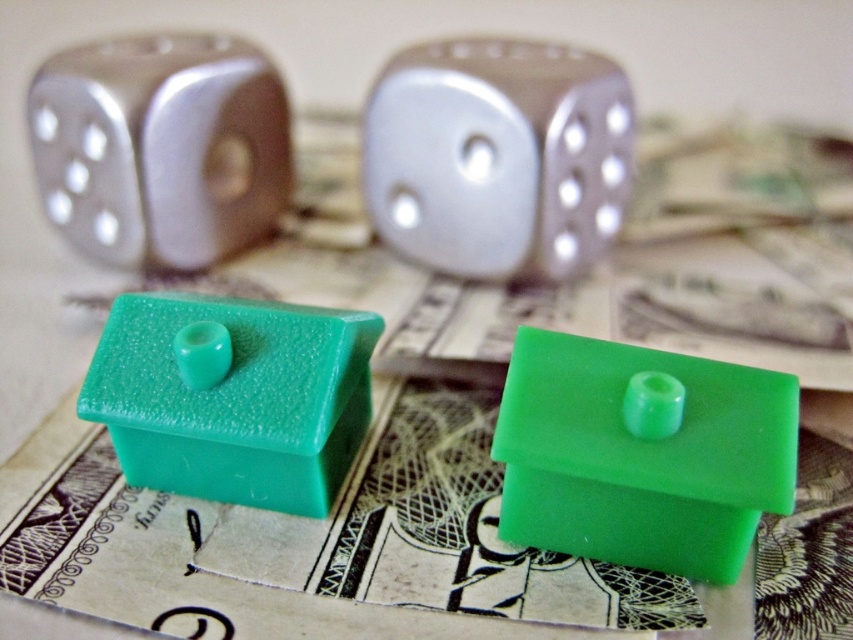
Is metallic silver die at center to the right of metallic silver die at upper left from the viewer's perspective?

Indeed, metallic silver die at center is positioned on the right side of metallic silver die at upper left.

Which is in front, point (498, 262) or point (230, 172)?

Positioned in front is point (498, 262).

Locate an element on the screen. The height and width of the screenshot is (640, 853). metallic silver die at center is located at coordinates (497, 156).

Is metallic silver die at center shorter than teal matte house at center?

In fact, metallic silver die at center may be taller than teal matte house at center.

Does metallic silver die at center have a greater height compared to teal matte house at center?

Yes.

Is point (575, 96) positioned before point (262, 353)?

That is False.

The width and height of the screenshot is (853, 640). What are the coordinates of `metallic silver die at center` in the screenshot? It's located at (497, 156).

Which is in front, point (227, 248) or point (184, 468)?

Positioned in front is point (184, 468).

Describe the element at coordinates (160, 147) in the screenshot. I see `metallic silver die at upper left` at that location.

Based on the photo, measure the distance between metallic silver die at upper left and camera.

metallic silver die at upper left and camera are 1.35 meters apart.

Locate an element on the screen. Image resolution: width=853 pixels, height=640 pixels. metallic silver die at upper left is located at coordinates (160, 147).